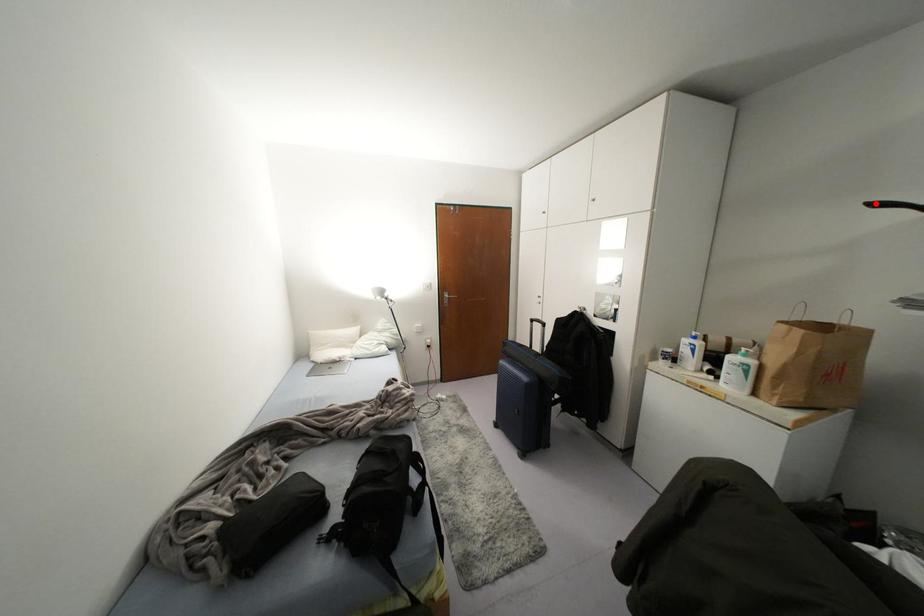
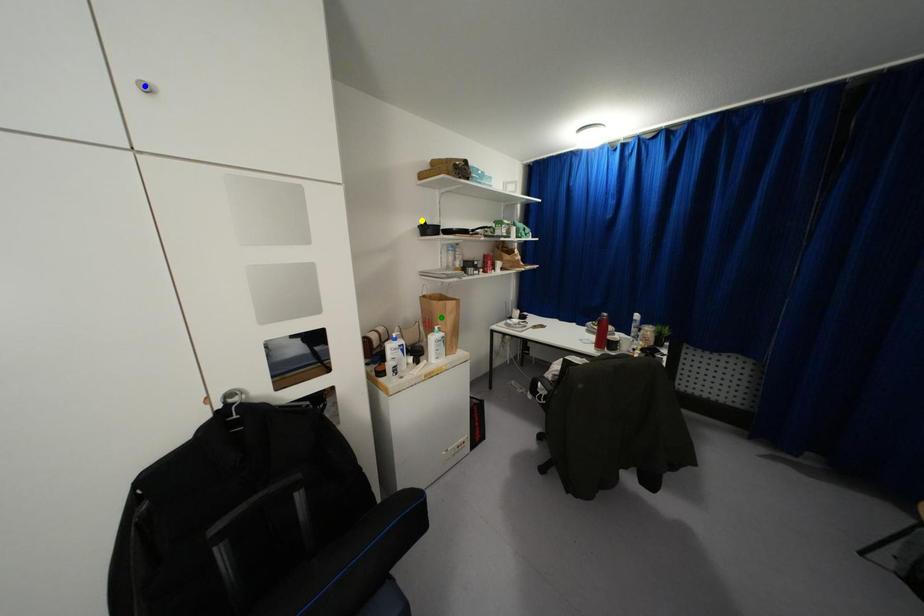
Question: I am providing you with two images of the same scene from different viewpoints. A red point is marked on the first image. You are given multiple points on the second image. Which mark in image 2 goes with the point in image 1?

Choices:
 (A) green point
 (B) yellow point
 (C) blue point

Answer: (B)